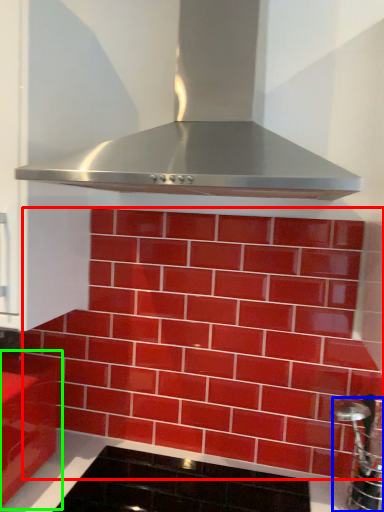
Question: Considering the real-world distances, which object is closest to brickwork (highlighted by a red box)? stainless steel (highlighted by a blue box) or cabinetry (highlighted by a green box).

Choices:
 (A) stainless steel
 (B) cabinetry

Answer: (A)